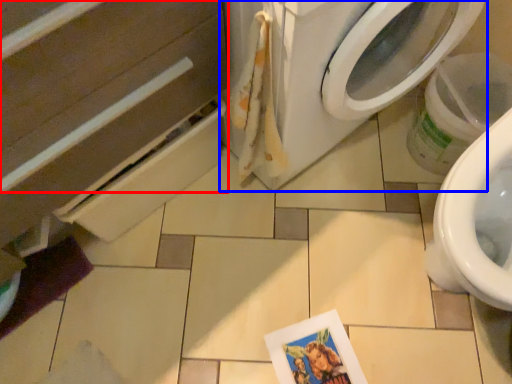
Question: Among these objects, which one is farthest to the camera, drawer (highlighted by a red box) or washing machine (highlighted by a blue box)?

Choices:
 (A) drawer
 (B) washing machine

Answer: (B)